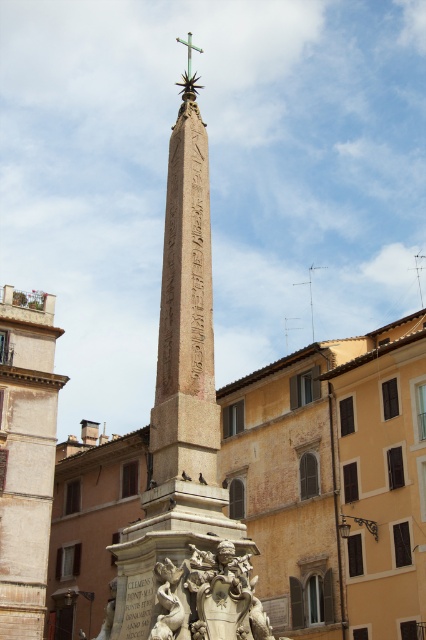
You are an art historian visiting the site and want to take a photo of both the beige stone obelisk at center and the polished stone sculpture at center. Since you want to include both in the frame, which one should you focus on first to ensure both are visible?

You should focus on the beige stone obelisk at center first because it is located below the polished stone sculpture at center, so by framing the lower one, you can capture both in the same shot.

You are a tour guide leading a group to a historical site. You want to inform your group about the distance between the beige stone obelisk at center and the polished stone sculpture at center. What would you tell them?

The beige stone obelisk at center is 17.58 meters away from the polished stone sculpture at center.

You are standing at point (x=169, y=577) and want to walk towards the obelisk. Is the point (x=181, y=316) behind you or in front of you relative to your direction of movement?

The point (x=181, y=316) is behind you relative to your direction of movement since it is stated to be behind point (x=169, y=577).